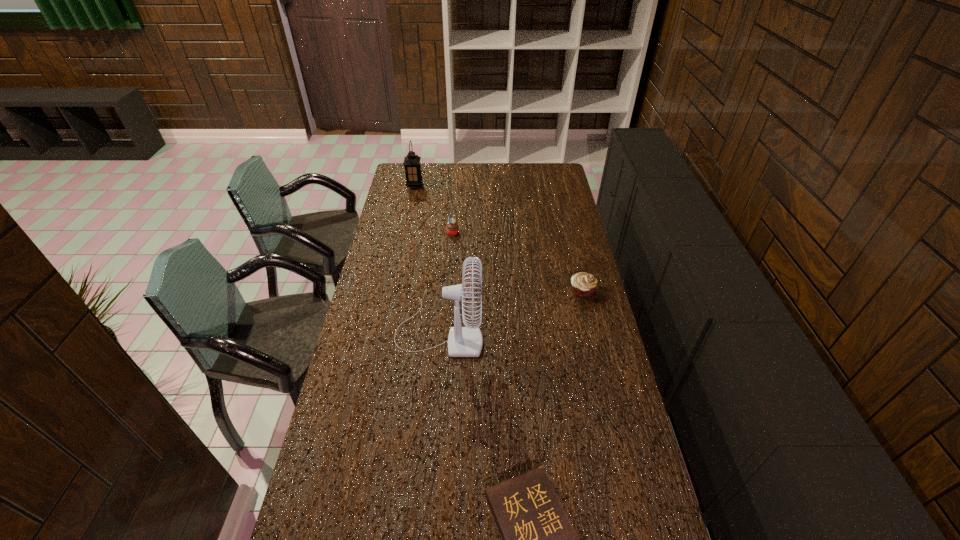
This screenshot has width=960, height=540. In order to click on the tallest object in this screenshot , I will do `click(467, 341)`.

Identify the location of the fourth shortest object. (411, 162).

You are a GUI agent. You are given a task and a screenshot of the screen. Output one action in this format:
    pyautogui.click(x=<x>, y=<y>)
    Task: Click on the lantern
    Image resolution: width=960 pixels, height=540 pixels.
    Given the screenshot: What is the action you would take?
    pyautogui.click(x=411, y=162)

Image resolution: width=960 pixels, height=540 pixels. I want to click on the fourth nearest object, so click(x=452, y=228).

In order to click on the farther muffin in this screenshot , I will do click(x=452, y=228).

I want to click on the rightmost object, so click(583, 284).

You are a GUI agent. You are given a task and a screenshot of the screen. Output one action in this format:
    pyautogui.click(x=<x>, y=<y>)
    Task: Click on the nearer muffin
    
    Given the screenshot: What is the action you would take?
    pyautogui.click(x=583, y=284)

You are a GUI agent. You are given a task and a screenshot of the screen. Output one action in this format:
    pyautogui.click(x=<x>, y=<y>)
    Task: Click on the free space located on the front-facing side of the tallest object
    Image resolution: width=960 pixels, height=540 pixels.
    Given the screenshot: What is the action you would take?
    pyautogui.click(x=568, y=331)

Locate an element on the screen. vacant space positioned 0.100m on the front of the lantern is located at coordinates (412, 201).

I want to click on vacant space located on the front-facing side of the farther muffin, so click(522, 232).